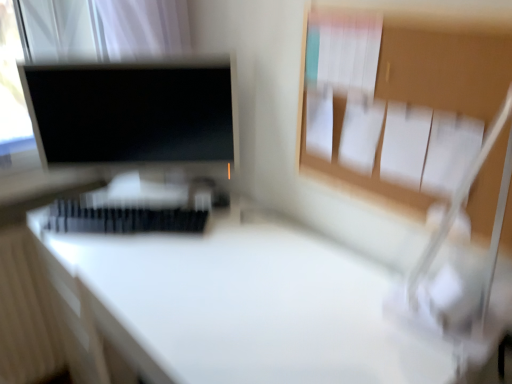
Question: Considering the positions of point (229, 365) and point (61, 158), is point (229, 365) closer or farther from the camera than point (61, 158)?

Choices:
 (A) closer
 (B) farther

Answer: (A)

Question: Would you say white glossy desk at center is inside or outside matte black monitor at upper left?

Choices:
 (A) outside
 (B) inside

Answer: (A)

Question: Which is farther from the white glossy desk at center?

Choices:
 (A) matte black monitor at upper left
 (B) white plastic keyboard at center

Answer: (A)

Question: Which object is the closest to the matte black monitor at upper left?

Choices:
 (A) white plastic keyboard at center
 (B) white glossy desk at center

Answer: (A)